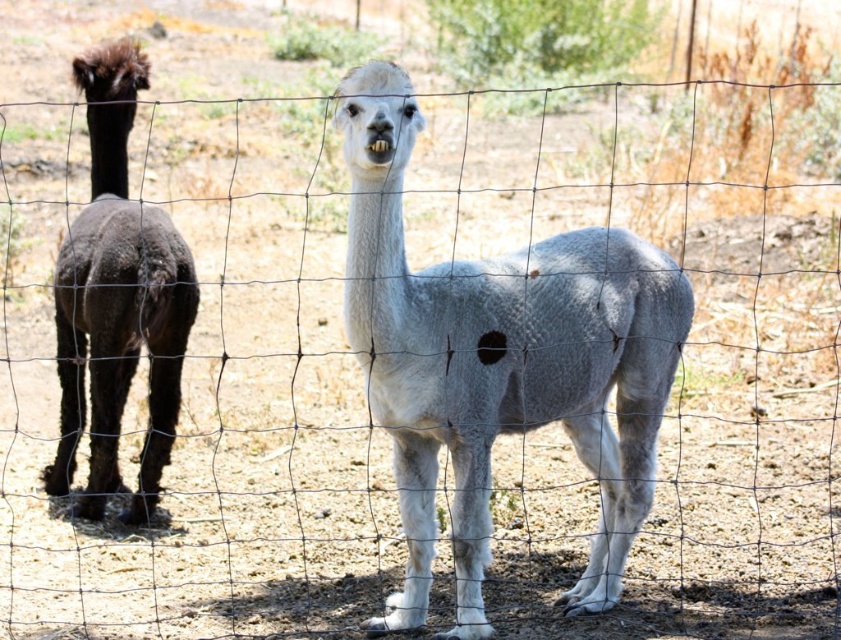
Between white woolen alpaca at center and dark brown woolly alpaca at left, which one appears on the right side from the viewer's perspective?

From the viewer's perspective, white woolen alpaca at center appears more on the right side.

Is white woolen alpaca at center taller than dark brown woolly alpaca at left?

No, white woolen alpaca at center is not taller than dark brown woolly alpaca at left.

This screenshot has width=841, height=640. In order to click on white woolen alpaca at center in this screenshot , I will do `click(500, 362)`.

At what (x,y) coordinates should I click in order to perform the action: click on white woolen alpaca at center. Please return your answer as a coordinate pair (x, y). The height and width of the screenshot is (640, 841). Looking at the image, I should click on (500, 362).